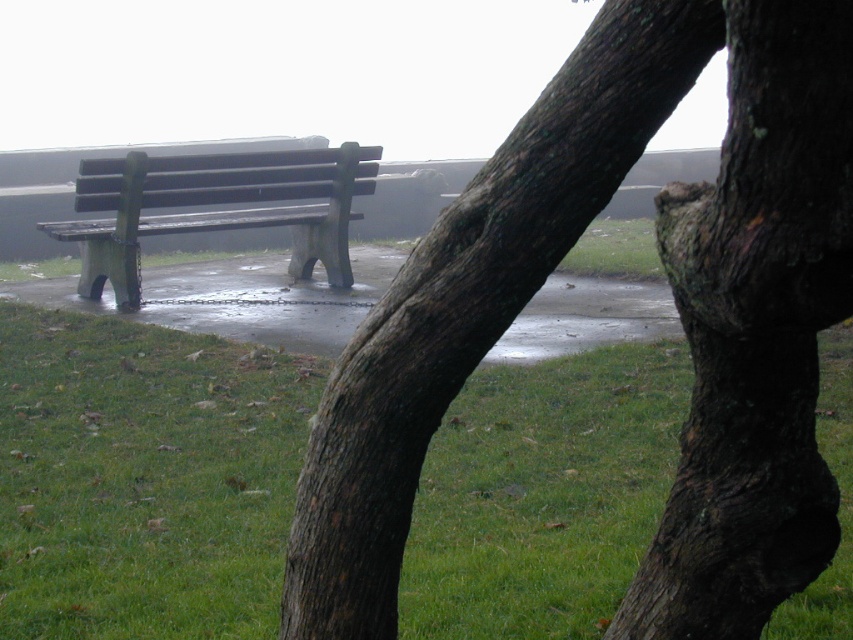
Question: Estimate the real-world distances between objects in this image. Which object is farther from the green grass at lower center?

Choices:
 (A) wooden bench at left
 (B) dark brown textured bark at center

Answer: (B)

Question: Is dark brown textured bark at center wider than wooden bench at left?

Choices:
 (A) no
 (B) yes

Answer: (A)

Question: Is the position of dark brown textured bark at center more distant than that of wooden bench at left?

Choices:
 (A) yes
 (B) no

Answer: (B)

Question: Among these objects, which one is farthest from the camera?

Choices:
 (A) green grass at lower center
 (B) dark brown textured bark at center
 (C) wooden bench at left

Answer: (C)

Question: Considering the real-world distances, which object is farthest from the green grass at lower center?

Choices:
 (A) dark brown textured bark at center
 (B) wooden bench at left

Answer: (A)

Question: Where is dark brown textured bark at center located in relation to wooden bench at left in the image?

Choices:
 (A) left
 (B) right

Answer: (B)